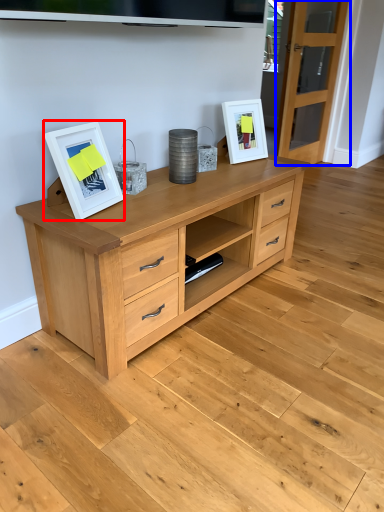
Question: Which of the following is the farthest to the observer, picture frame (highlighted by a red box) or glass door (highlighted by a blue box)?

Choices:
 (A) picture frame
 (B) glass door

Answer: (B)